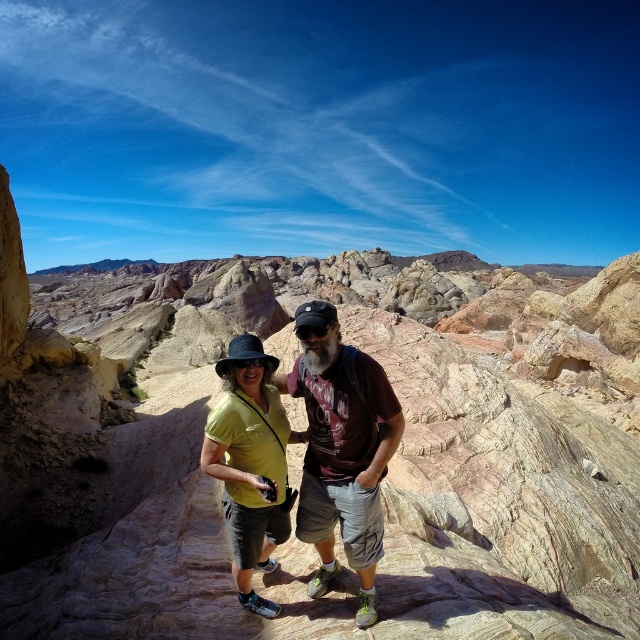
Question: Which object appears farthest from the camera in this image?

Choices:
 (A) matte brown t-shirt at center
 (B) matte yellow shirt at center
 (C) rustic stone canyon at center

Answer: (B)

Question: Where is matte brown t-shirt at center located in relation to matte yellow shirt at center in the image?

Choices:
 (A) below
 (B) above

Answer: (B)

Question: Which object appears closest to the camera in this image?

Choices:
 (A) rustic stone canyon at center
 (B) matte brown t-shirt at center
 (C) matte yellow shirt at center

Answer: (A)

Question: Is rustic stone canyon at center wider than matte brown t-shirt at center?

Choices:
 (A) yes
 (B) no

Answer: (A)

Question: Among these points, which one is farthest from the camera?

Choices:
 (A) (280, 429)
 (B) (358, 525)
 (C) (74, 388)

Answer: (C)

Question: Can you confirm if rustic stone canyon at center is bigger than matte yellow shirt at center?

Choices:
 (A) no
 (B) yes

Answer: (B)